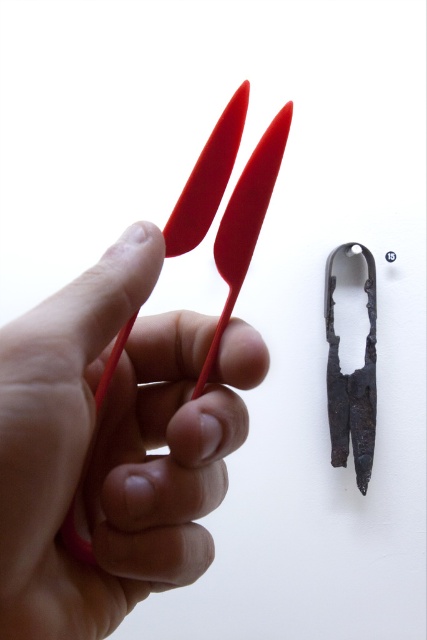
Question: Is matte plastic scissors at center smaller than matte plastic scissors at left?

Choices:
 (A) yes
 (B) no

Answer: (B)

Question: Can you confirm if matte plastic scissors at center is thinner than matte plastic scissors at left?

Choices:
 (A) yes
 (B) no

Answer: (B)

Question: Is matte plastic scissors at center wider than matte plastic scissors at left?

Choices:
 (A) no
 (B) yes

Answer: (B)

Question: Which object appears closest to the camera in this image?

Choices:
 (A) matte plastic scissors at center
 (B) matte plastic scissors at left

Answer: (A)